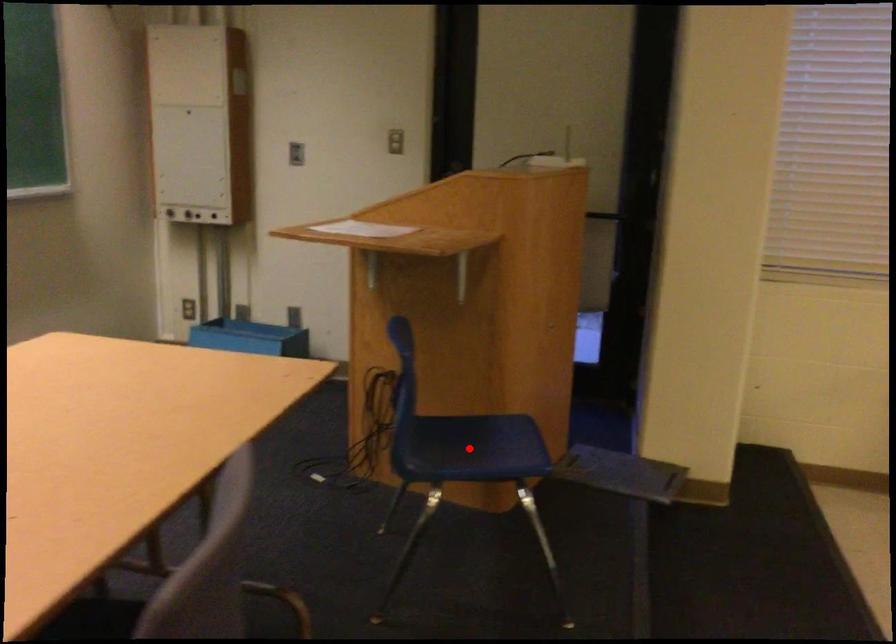
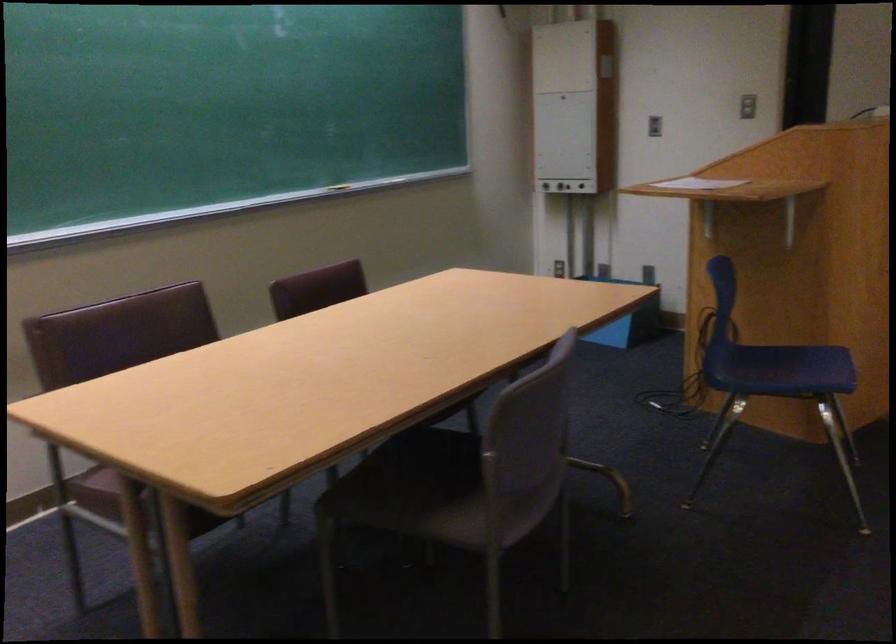
Question: I am providing you with two images of the same scene from different viewpoints. Given a red point in image1, look at the same physical point in image2. Is it:

Choices:
 (A) Closer to the viewpoint
 (B) Farther from the viewpoint

Answer: (B)